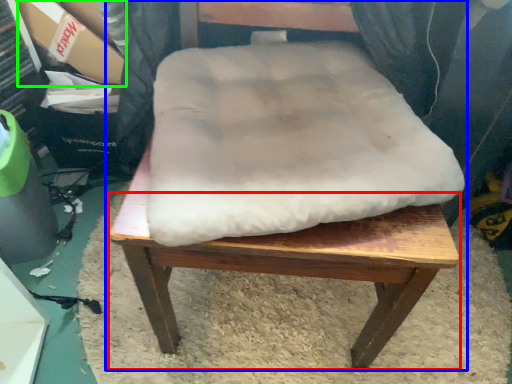
Question: Considering the real-world distances, which object is farthest from step stool (highlighted by a red box)? chair (highlighted by a blue box) or cardboard box (highlighted by a green box)?

Choices:
 (A) chair
 (B) cardboard box

Answer: (B)